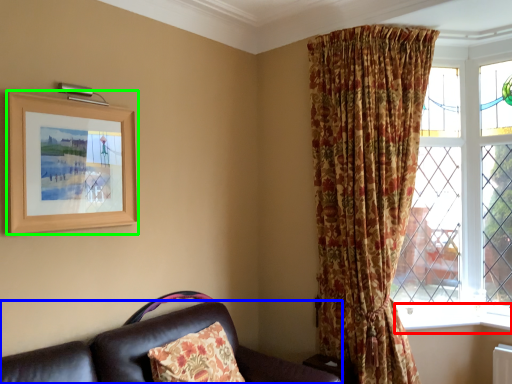
Question: Which object is positioned farthest from window sill (highlighted by a red box)? Select from studio couch (highlighted by a blue box) and picture frame (highlighted by a green box).

Choices:
 (A) studio couch
 (B) picture frame

Answer: (B)